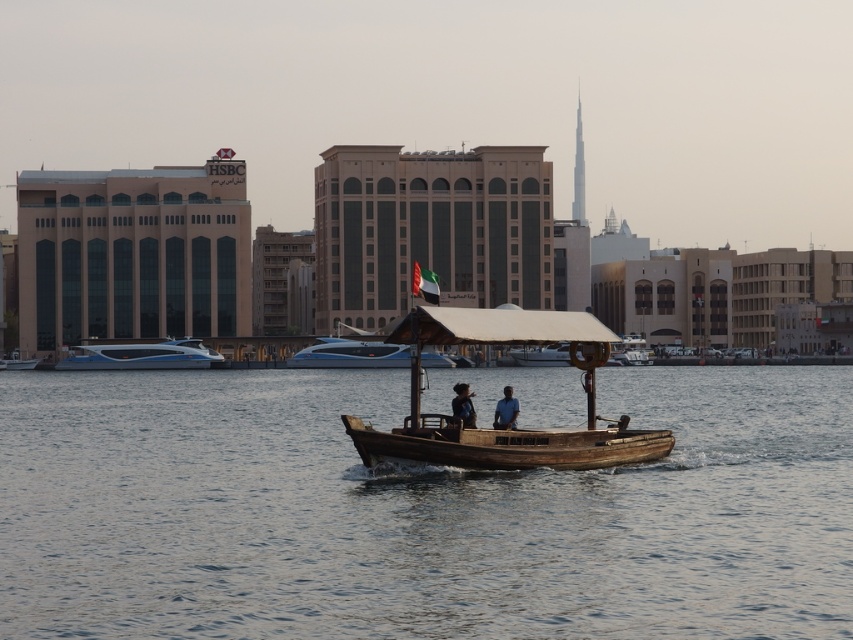
Which is behind, point (387, 378) or point (134, 346)?

Point (134, 346)

Which is in front, point (80, 518) or point (183, 355)?

Positioned in front is point (80, 518).

Image resolution: width=853 pixels, height=640 pixels. Identify the location of smooth water at center. (416, 513).

Where is `smooth water at center`? The height and width of the screenshot is (640, 853). smooth water at center is located at coordinates (416, 513).

Which is more to the right, blue glossy speedboat at left or white glossy speedboat at center?

white glossy speedboat at center

Is point (165, 346) closer to viewer compared to point (433, 364)?

No, it is behind (433, 364).

Does point (122, 362) come behind point (368, 344)?

That is False.

You are a GUI agent. You are given a task and a screenshot of the screen. Output one action in this format:
    pyautogui.click(x=<x>, y=<y>)
    Task: Click on the blue glossy speedboat at left
    
    Given the screenshot: What is the action you would take?
    pyautogui.click(x=141, y=356)

Between point (639, 460) and point (86, 352), which one is positioned in front?

Positioned in front is point (639, 460).

Image resolution: width=853 pixels, height=640 pixels. Identify the location of wooden boat at center. (506, 428).